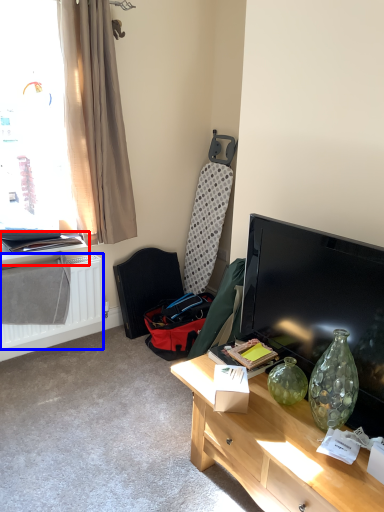
Question: Which point is further to the camera, window sill (highlighted by a red box) or radiator (highlighted by a blue box)?

Choices:
 (A) window sill
 (B) radiator

Answer: (A)